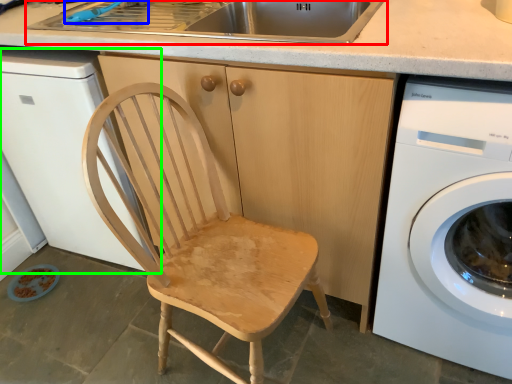
Question: Which object is the farthest from sink (highlighted by a red box)? Choose among these: faucet (highlighted by a blue box) or dish washer (highlighted by a green box).

Choices:
 (A) faucet
 (B) dish washer

Answer: (B)